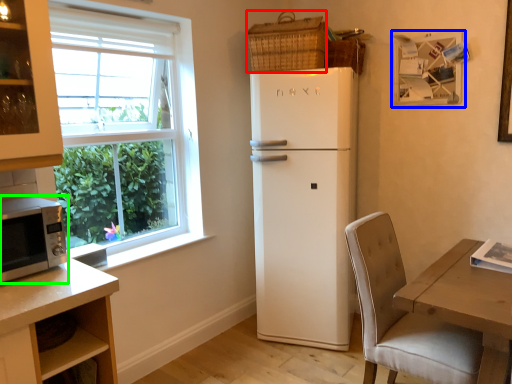
Question: Considering the real-world distances, which object is closest to basket (highlighted by a red box)? picture frame (highlighted by a blue box) or microwave oven (highlighted by a green box).

Choices:
 (A) picture frame
 (B) microwave oven

Answer: (A)